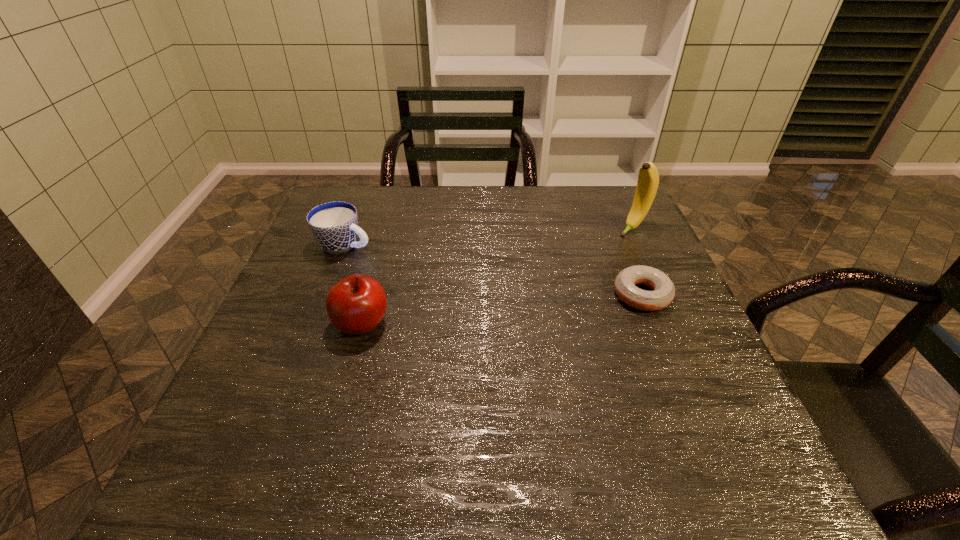
Locate an element on the screen. The width and height of the screenshot is (960, 540). vacant space at the left edge of the desktop is located at coordinates (330, 334).

This screenshot has width=960, height=540. I want to click on vacant space at the right edge, so 693,324.

In order to click on vacant space at the far left corner in this screenshot , I will do `click(364, 223)`.

Where is `free point at the near left corner`? The width and height of the screenshot is (960, 540). free point at the near left corner is located at coordinates (261, 432).

In the image, there is a desktop. Identify the location of vacant space at the far right corner. (614, 192).

Image resolution: width=960 pixels, height=540 pixels. Find the location of `free space between the doughnut and the tallest object`. free space between the doughnut and the tallest object is located at coordinates click(x=637, y=261).

Where is `free point between the tallest object and the apple`? The height and width of the screenshot is (540, 960). free point between the tallest object and the apple is located at coordinates (497, 276).

What are the coordinates of `empty space between the shortest object and the banana` in the screenshot? It's located at (637, 261).

Locate an element on the screen. This screenshot has width=960, height=540. free spot between the doughnut and the apple is located at coordinates (502, 309).

The width and height of the screenshot is (960, 540). Find the location of `free space between the banana and the third shortest object`. free space between the banana and the third shortest object is located at coordinates (497, 276).